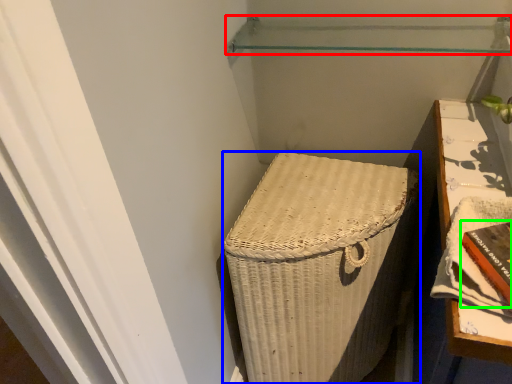
Question: Which is farther away from shelf (highlighted by a red box)? furniture (highlighted by a blue box) or book (highlighted by a green box)?

Choices:
 (A) furniture
 (B) book

Answer: (B)